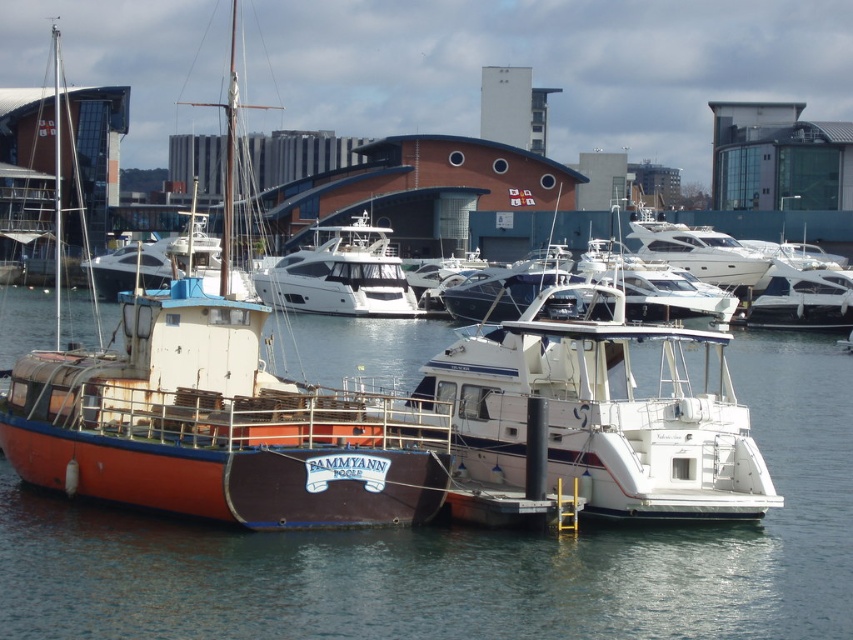
Question: Is smooth water at center behind white glossy yacht at center?

Choices:
 (A) yes
 (B) no

Answer: (B)

Question: Is smooth water at center above rusty metal boat at left?

Choices:
 (A) yes
 (B) no

Answer: (B)

Question: Which is farther from the white glossy yacht at center?

Choices:
 (A) rusty metal boat at left
 (B) smooth water at center

Answer: (A)

Question: Which object appears closest to the camera in this image?

Choices:
 (A) white glossy yacht at center
 (B) rusty metal boat at left
 (C) white glossy boat at center
 (D) smooth water at center

Answer: (D)

Question: Which point is farther from the camera taking this photo?

Choices:
 (A) (323, 246)
 (B) (465, 483)

Answer: (A)

Question: Can you confirm if smooth water at center is positioned to the right of white glossy boat at center?

Choices:
 (A) yes
 (B) no

Answer: (B)